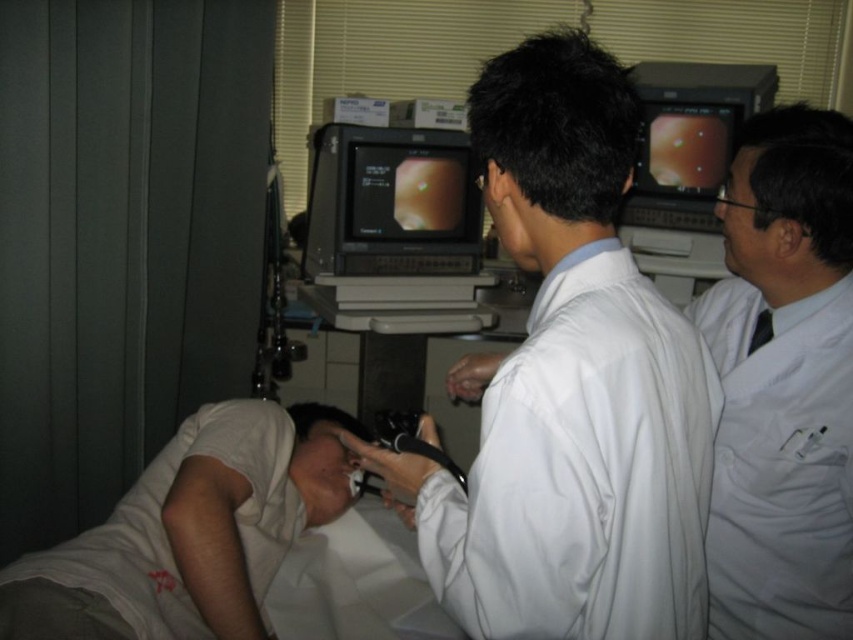
You are a medical student observing a procedure in the operating room. You notice two white lab coats in the scene. Which one is closer to you, the white smooth lab coat at center or the white lab coat at upper right?

The white smooth lab coat at center is closer to you than the white lab coat at upper right.

You are a medical student observing a procedure in the operating room. You notice the white smooth lab coat at center and the black glossy monitor at center. Which object is closer to the floor?

The white smooth lab coat at center is positioned under the black glossy monitor at center, so the lab coat is closer to the floor.